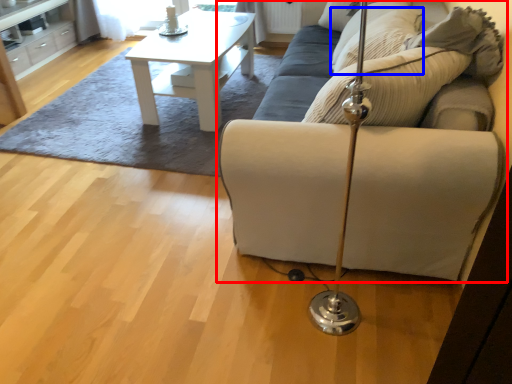
Question: Which object appears farthest to the camera in this image, studio couch (highlighted by a red box) or pillow (highlighted by a blue box)?

Choices:
 (A) studio couch
 (B) pillow

Answer: (B)